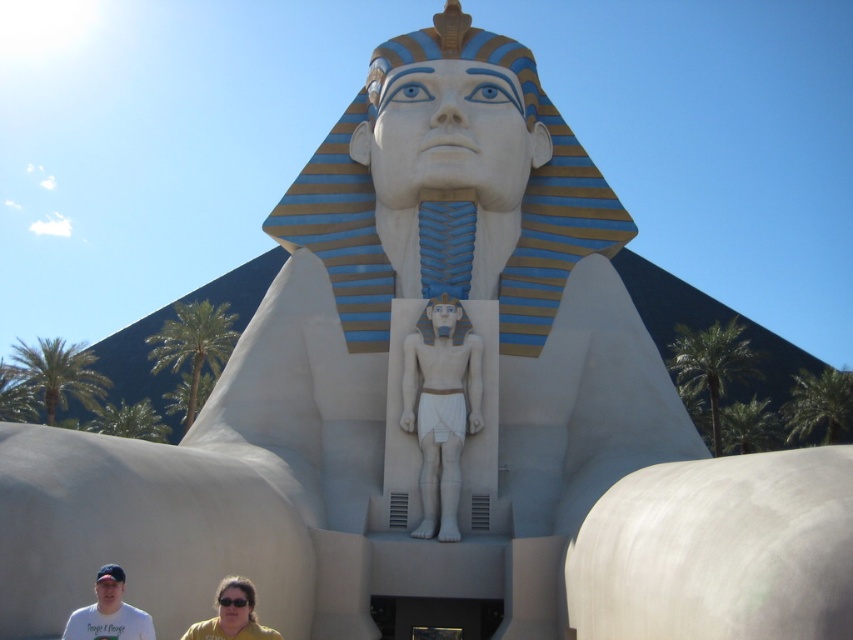
Is point (432, 428) behind point (247, 618)?

Yes.

Locate an element on the screen. white marble statue at center is located at coordinates (440, 406).

Between yellow t-shirt at lower center and white t-shirt at lower left, which one is positioned higher?

Positioned higher is white t-shirt at lower left.

Who is more forward, (265, 628) or (102, 566)?

Point (102, 566) is more forward.

Between point (106, 589) and point (109, 621), which one is positioned in front?

Positioned in front is point (109, 621).

Find the location of a particular element. yellow t-shirt at lower center is located at coordinates (109, 612).

Which of these two, white marble statue at center or white t-shirt at lower left, stands shorter?

white t-shirt at lower left

Is white marble statue at center to the left of white t-shirt at lower left from the viewer's perspective?

Incorrect, white marble statue at center is not on the left side of white t-shirt at lower left.

Is point (434, 330) behind point (113, 625)?

Yes, point (434, 330) is behind point (113, 625).

Identify the location of white marble statue at center. (440, 406).